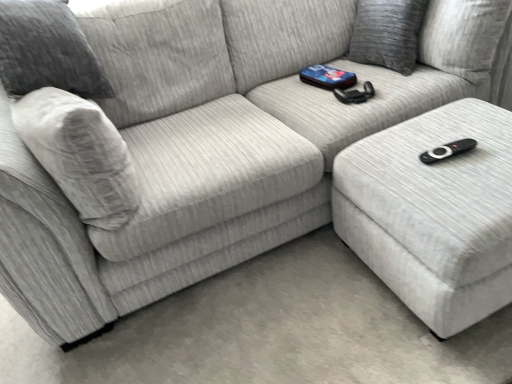
Question: In terms of height, does gray fabric pillow at upper right look taller or shorter compared to white fabric ottoman at lower right?

Choices:
 (A) tall
 (B) short

Answer: (B)

Question: Considering the positions of point (374, 23) and point (397, 289), is point (374, 23) closer or farther from the camera than point (397, 289)?

Choices:
 (A) farther
 (B) closer

Answer: (A)

Question: Based on their sizes in the image, would you say gray fabric pillow at upper right is bigger or smaller than white fabric ottoman at lower right?

Choices:
 (A) small
 (B) big

Answer: (A)

Question: From a real-world perspective, relative to gray fabric pillow at upper right, is white fabric ottoman at lower right vertically above or below?

Choices:
 (A) above
 (B) below

Answer: (B)

Question: In terms of size, does white fabric ottoman at lower right appear bigger or smaller than gray fabric pillow at upper right?

Choices:
 (A) big
 (B) small

Answer: (A)

Question: Is white fabric ottoman at lower right situated inside gray fabric pillow at upper right or outside?

Choices:
 (A) inside
 (B) outside

Answer: (B)

Question: In the image, is white fabric ottoman at lower right positioned in front of or behind gray fabric pillow at upper right?

Choices:
 (A) front
 (B) behind

Answer: (A)